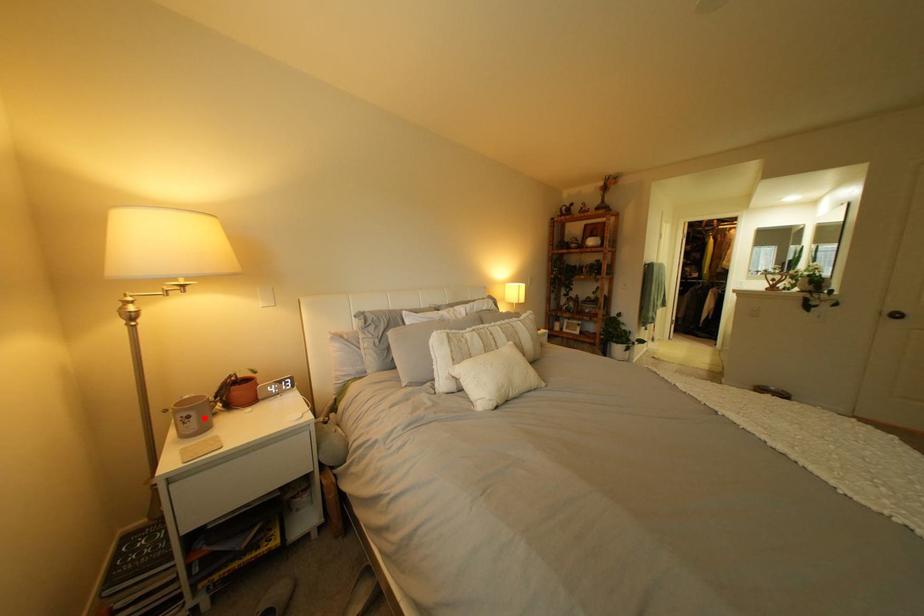
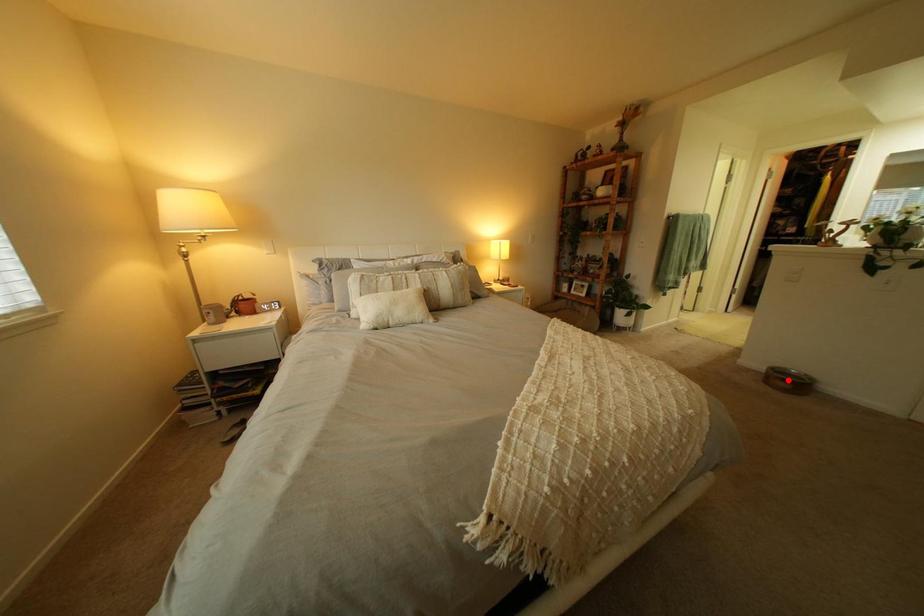
I am providing you with two images of the same scene from different viewpoints. A red point is marked on the first image and another point is marked on the second image. Is the red point in image1 aligned with the point shown in image2?

No